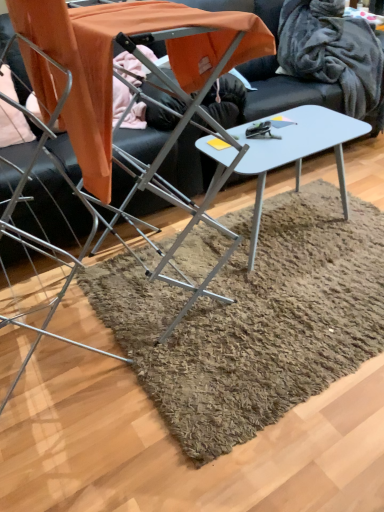
Question: Considering the relative positions of metallic gray table at center, the 1th table from the front, and metallic silver chair at left in the image provided, is metallic gray table at center, the 1th table from the front, to the left of metallic silver chair at left from the viewer's perspective?

Choices:
 (A) yes
 (B) no

Answer: (B)

Question: From a real-world perspective, is metallic gray table at center, the 1th table from the front, on top of metallic silver chair at left?

Choices:
 (A) yes
 (B) no

Answer: (B)

Question: Can you confirm if metallic gray table at center, arranged as the 2th table when viewed from the back, is smaller than metallic silver chair at left?

Choices:
 (A) no
 (B) yes

Answer: (A)

Question: From the image's perspective, is metallic gray table at center, arranged as the 2th table when viewed from the back, beneath metallic silver chair at left?

Choices:
 (A) yes
 (B) no

Answer: (A)

Question: Does metallic gray table at center, arranged as the 2th table when viewed from the back, turn towards metallic silver chair at left?

Choices:
 (A) yes
 (B) no

Answer: (B)

Question: From a real-world perspective, is metallic silver chair at left positioned above or below light gray plastic table at center, which is counted as the second table, starting from the front?

Choices:
 (A) below
 (B) above

Answer: (B)

Question: Would you say metallic silver chair at left is to the left or to the right of light gray plastic table at center, the 1th table when ordered from back to front, in the picture?

Choices:
 (A) left
 (B) right

Answer: (A)

Question: In terms of width, does metallic silver chair at left look wider or thinner when compared to light gray plastic table at center, the 1th table when ordered from back to front?

Choices:
 (A) thin
 (B) wide

Answer: (B)

Question: Is metallic silver chair at left in front of or behind light gray plastic table at center, the 1th table when ordered from back to front, in the image?

Choices:
 (A) front
 (B) behind

Answer: (A)

Question: Considering the positions of metallic silver chair at left and velvety gray blanket at upper right in the image, is metallic silver chair at left bigger or smaller than velvety gray blanket at upper right?

Choices:
 (A) big
 (B) small

Answer: (B)

Question: Considering the relative positions of metallic silver chair at left and velvety gray blanket at upper right in the image provided, is metallic silver chair at left to the left or to the right of velvety gray blanket at upper right?

Choices:
 (A) right
 (B) left

Answer: (B)

Question: From a real-world perspective, is metallic silver chair at left above or below velvety gray blanket at upper right?

Choices:
 (A) below
 (B) above

Answer: (B)

Question: Is point (16, 232) positioned closer to the camera than point (314, 1)?

Choices:
 (A) closer
 (B) farther

Answer: (A)

Question: Based on their positions, is light gray plastic table at center, which is counted as the second table, starting from the front, located to the left or right of metallic silver chair at left?

Choices:
 (A) left
 (B) right

Answer: (B)

Question: Based on their sizes in the image, would you say light gray plastic table at center, the 1th table when ordered from back to front, is bigger or smaller than metallic silver chair at left?

Choices:
 (A) small
 (B) big

Answer: (B)